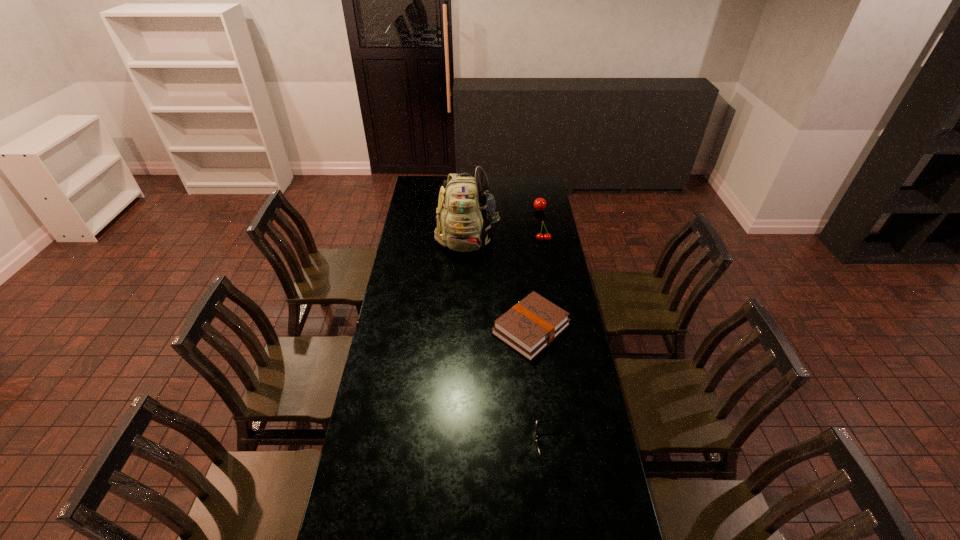
Locate an element on the screen. This screenshot has height=540, width=960. the tallest object is located at coordinates (465, 210).

Where is `the nearer cherry`? the nearer cherry is located at coordinates (539, 237).

Where is `the third tallest object`? Image resolution: width=960 pixels, height=540 pixels. the third tallest object is located at coordinates (540, 204).

Locate an element on the screen. the farthest object is located at coordinates (540, 204).

At what (x,y) coordinates should I click in order to perform the action: click on the fourth farthest object. Please return your answer as a coordinate pair (x, y). The width and height of the screenshot is (960, 540). Looking at the image, I should click on (529, 326).

I want to click on the second shortest object, so click(x=529, y=326).

What are the coordinates of `the shortest object` in the screenshot? It's located at (537, 421).

Image resolution: width=960 pixels, height=540 pixels. Identify the location of spectacles. (537, 421).

This screenshot has height=540, width=960. I want to click on vacant region located on the front-facing side of the tallest object, so click(465, 312).

Where is `free space located 0.140m with the stems of the nearer cherry pointing upwards`? The width and height of the screenshot is (960, 540). free space located 0.140m with the stems of the nearer cherry pointing upwards is located at coordinates (547, 260).